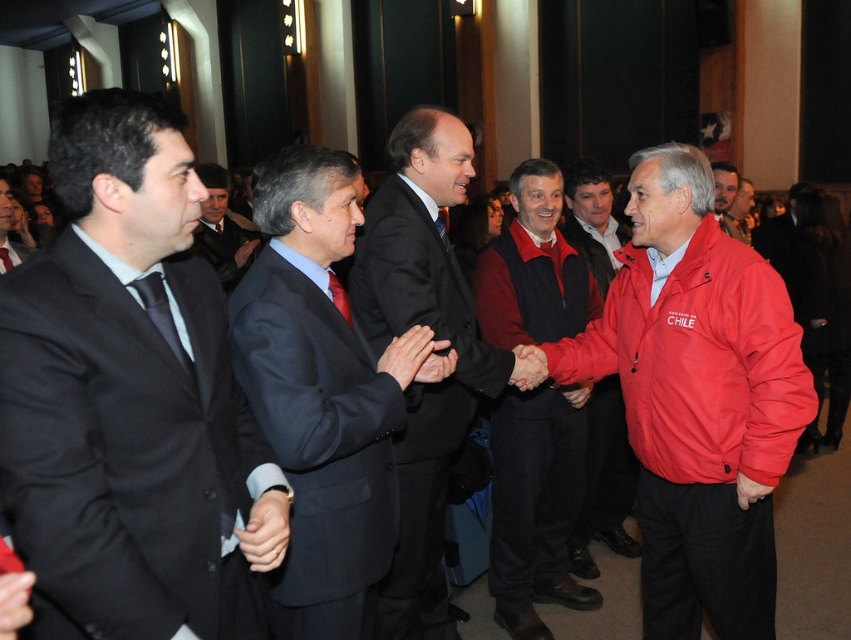
You are a photographer at this event and need to capture a photo of both the dark suit at center and the red fleece jacket at center. Which one should you focus on first to ensure it appears larger in the photo?

The dark suit at center has a larger size compared to the red fleece jacket at center, so you should focus on the dark suit at center first to ensure it appears larger in the photo.

You are a photographer at this event and need to capture a photo of the dark suit at center and the red fleece jacket at center. The camera you are using has a minimum focus distance of 20 inches. Can you take the photo without moving either subject?

The dark suit at center is 20.69 inches from the red fleece jacket at center. Since the distance between them is greater than the camera minimum focus distance of 20 inches, you can take the photo without moving either subject.